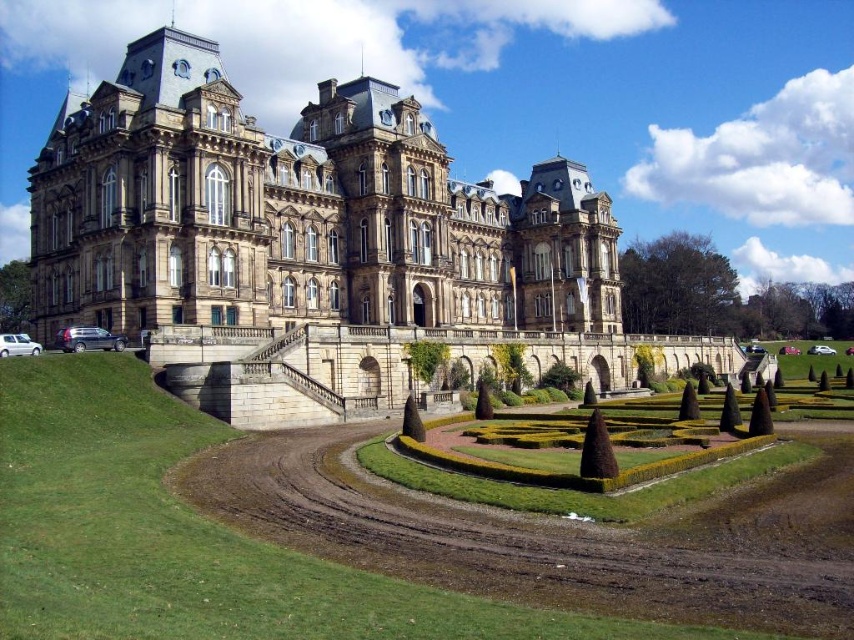
You are standing at the entrance of the brown stone castle at center and want to walk towards the green grass at lower center. Which direction should you move in?

You should move downward towards the green grass at lower center since the brown stone castle at center is located above it.

You are a landscape architect planning to install a new decorative fountain in the garden. The fountain requires a space wider than the green grass at lower center. Can the brown stone castle at center provide enough width for the fountain?

The brown stone castle at center is wider than the green grass at lower center, so it can provide enough width for the fountain.